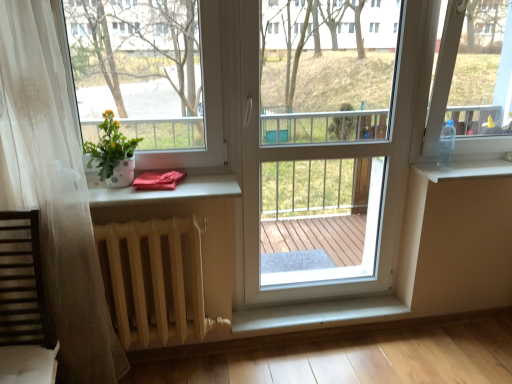
Question: Is white plastic window sill at right shorter than transparent plastic bottle at right, positioned as the first window screen in right-to-left order?

Choices:
 (A) yes
 (B) no

Answer: (A)

Question: Can you confirm if white plastic window sill at right is thinner than transparent plastic bottle at right, the 2th window screen when ordered from left to right?

Choices:
 (A) yes
 (B) no

Answer: (B)

Question: Are white plastic window sill at right and transparent plastic bottle at right, positioned as the first window screen in right-to-left order, far apart?

Choices:
 (A) yes
 (B) no

Answer: (B)

Question: Is white plastic window sill at right at the left side of transparent plastic bottle at right, positioned as the first window screen in right-to-left order?

Choices:
 (A) yes
 (B) no

Answer: (A)

Question: From a real-world perspective, is white plastic window sill at right positioned under transparent plastic bottle at right, positioned as the first window screen in right-to-left order, based on gravity?

Choices:
 (A) no
 (B) yes

Answer: (B)

Question: Is white plastic window sill at right taller than transparent plastic bottle at right, positioned as the first window screen in right-to-left order?

Choices:
 (A) yes
 (B) no

Answer: (B)

Question: Is white plastic window sill at right further to the viewer compared to white glossy pot at left?

Choices:
 (A) yes
 (B) no

Answer: (A)

Question: Is white glossy pot at left located within white plastic window sill at right?

Choices:
 (A) yes
 (B) no

Answer: (B)

Question: Is white plastic window sill at right outside white glossy pot at left?

Choices:
 (A) no
 (B) yes

Answer: (B)

Question: Considering the relative sizes of white plastic window sill at right and white glossy pot at left in the image provided, is white plastic window sill at right shorter than white glossy pot at left?

Choices:
 (A) yes
 (B) no

Answer: (A)

Question: From the image's perspective, does white plastic window sill at right appear higher than white glossy pot at left?

Choices:
 (A) no
 (B) yes

Answer: (A)

Question: Considering the relative sizes of white plastic window sill at right and white glossy pot at left in the image provided, is white plastic window sill at right taller than white glossy pot at left?

Choices:
 (A) no
 (B) yes

Answer: (A)

Question: Can you confirm if white glossy pot at left is shorter than wooden slats rocking chair at lower left?

Choices:
 (A) yes
 (B) no

Answer: (A)